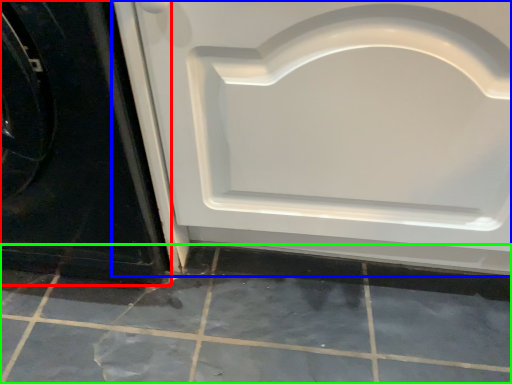
Question: Based on their relative distances, which object is nearer to door (highlighted by a red box)? Choose from door (highlighted by a blue box) and ceramic tile (highlighted by a green box).

Choices:
 (A) door
 (B) ceramic tile

Answer: (A)